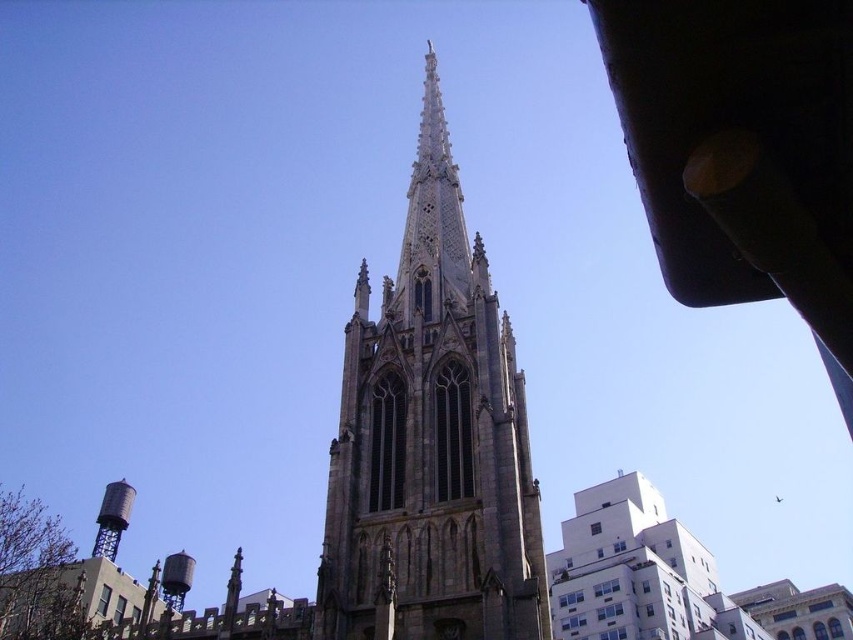
Question: Among these objects, which one is farthest from the camera?

Choices:
 (A) silver metallic water tower at lower left
 (B) brown stone tower at center

Answer: (A)

Question: Does brown stone tower at center appear over silver metallic water tower at lower left?

Choices:
 (A) yes
 (B) no

Answer: (A)

Question: Is the position of brown stone tower at center more distant than that of silver metallic water tower at lower left?

Choices:
 (A) yes
 (B) no

Answer: (B)

Question: Is brown stone tower at center in front of silver metallic water tower at lower left?

Choices:
 (A) yes
 (B) no

Answer: (A)